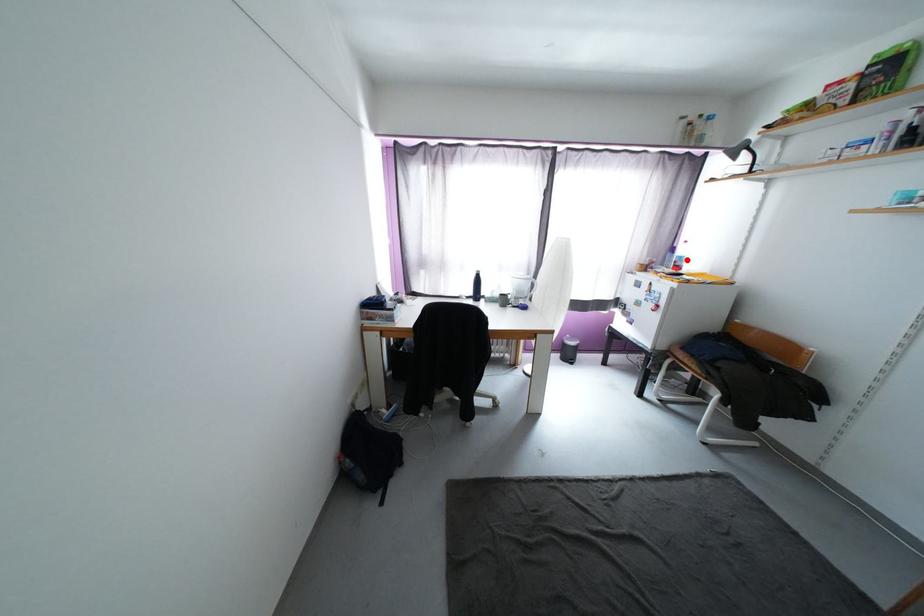
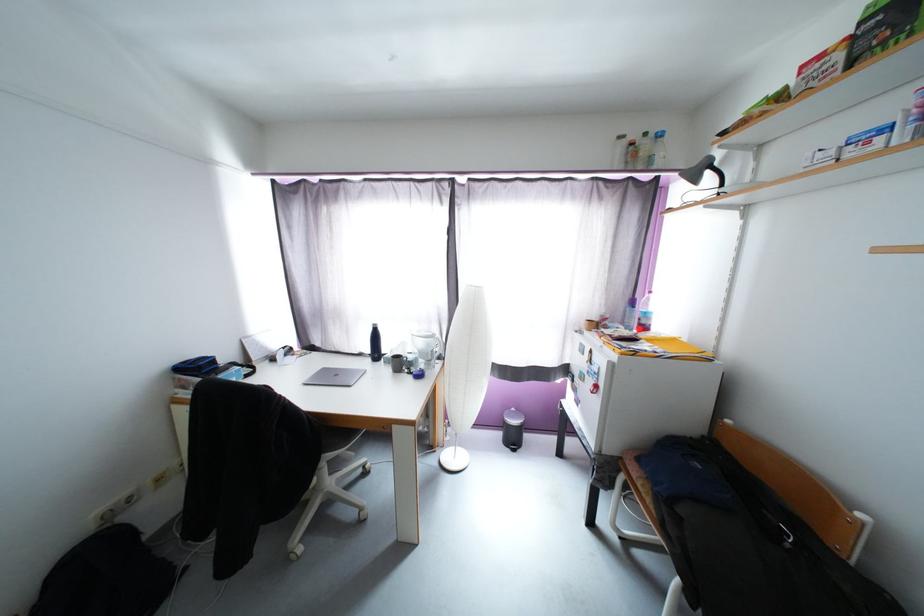
Locate, in the second image, the point that corresponds to the highlighted location in the first image.

(651, 315)